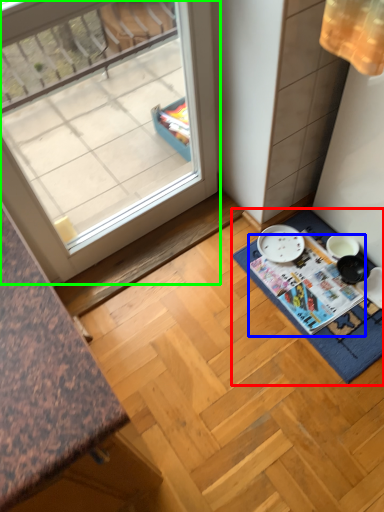
Question: Which object is positioned closest to bath mat (highlighted by a red box)? Select from magazine (highlighted by a blue box) and window (highlighted by a green box).

Choices:
 (A) magazine
 (B) window

Answer: (A)